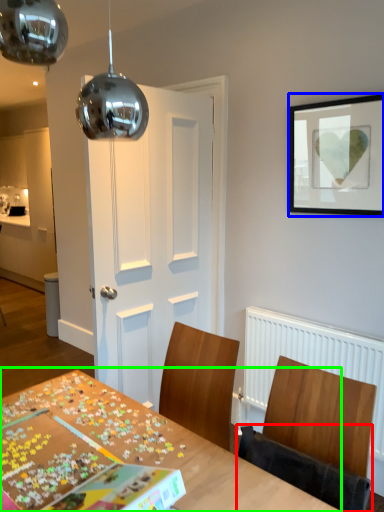
Question: Which is nearer to the chair (highlighted by a red box)? picture frame (highlighted by a blue box) or table (highlighted by a green box).

Choices:
 (A) picture frame
 (B) table

Answer: (B)